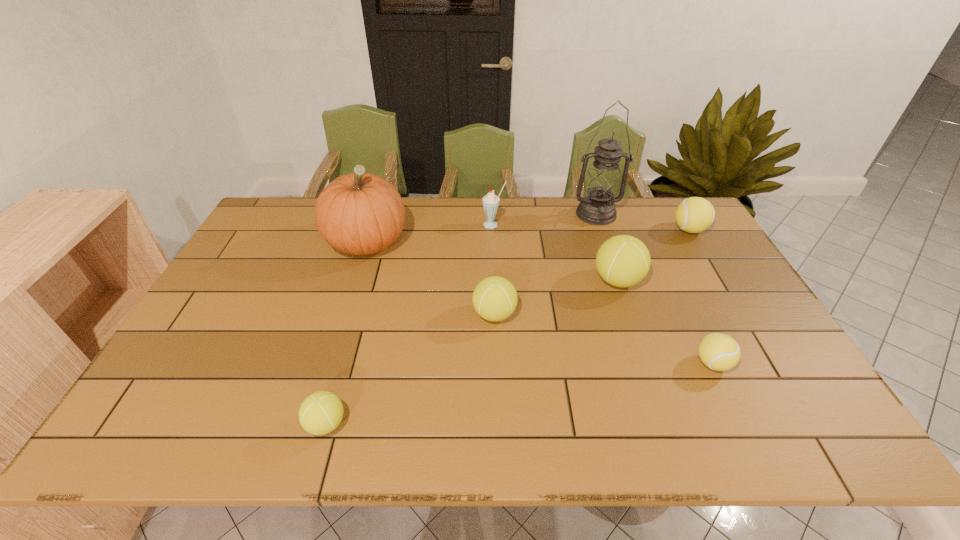
The height and width of the screenshot is (540, 960). Find the location of `vacant area in the image that satisfies the following two spatial constraints: 1. on the back side of the second biggest green tennis ball; 2. on the right side of the third tennis ball from left to right`. vacant area in the image that satisfies the following two spatial constraints: 1. on the back side of the second biggest green tennis ball; 2. on the right side of the third tennis ball from left to right is located at coordinates (493, 280).

The height and width of the screenshot is (540, 960). What are the coordinates of `vacant area in the image that satisfies the following two spatial constraints: 1. on the straw side of the white milkshake; 2. on the left side of the rightmost tennis ball` in the screenshot? It's located at (493, 230).